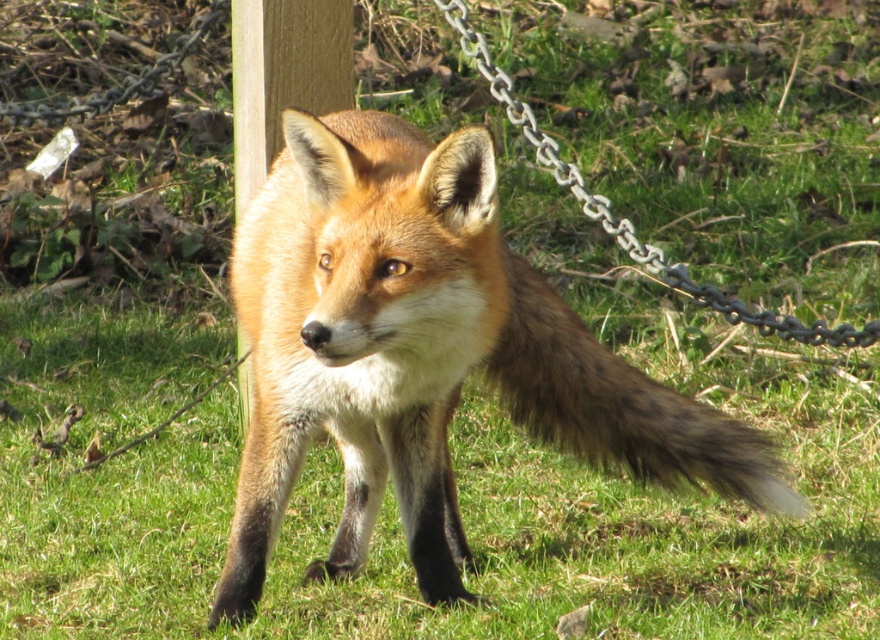
Between shiny orange fur fox at center and brown fuzzy tail at center, which one is positioned higher?

brown fuzzy tail at center is above.

Does shiny orange fur fox at center have a smaller size compared to brown fuzzy tail at center?

No.

Between point (363, 422) and point (653, 472), which one is positioned behind?

Point (653, 472)

Locate an element on the screen. This screenshot has width=880, height=640. shiny orange fur fox at center is located at coordinates [x=424, y=353].

Based on the photo, who is more distant from viewer, (x=246, y=368) or (x=621, y=248)?

The point (x=621, y=248) is more distant.

Is wooden post at center above metallic silver chain at upper center?

Yes, wooden post at center is above metallic silver chain at upper center.

The height and width of the screenshot is (640, 880). What are the coordinates of `wooden post at center` in the screenshot? It's located at (283, 76).

Does brown fuzzy tail at center appear on the left side of wooden post at center?

In fact, brown fuzzy tail at center is to the right of wooden post at center.

Can you confirm if brown fuzzy tail at center is positioned below wooden post at center?

Correct, brown fuzzy tail at center is located below wooden post at center.

Is point (760, 488) closer to viewer compared to point (306, 32)?

Yes, it is.

Image resolution: width=880 pixels, height=640 pixels. I want to click on brown fuzzy tail at center, so click(620, 404).